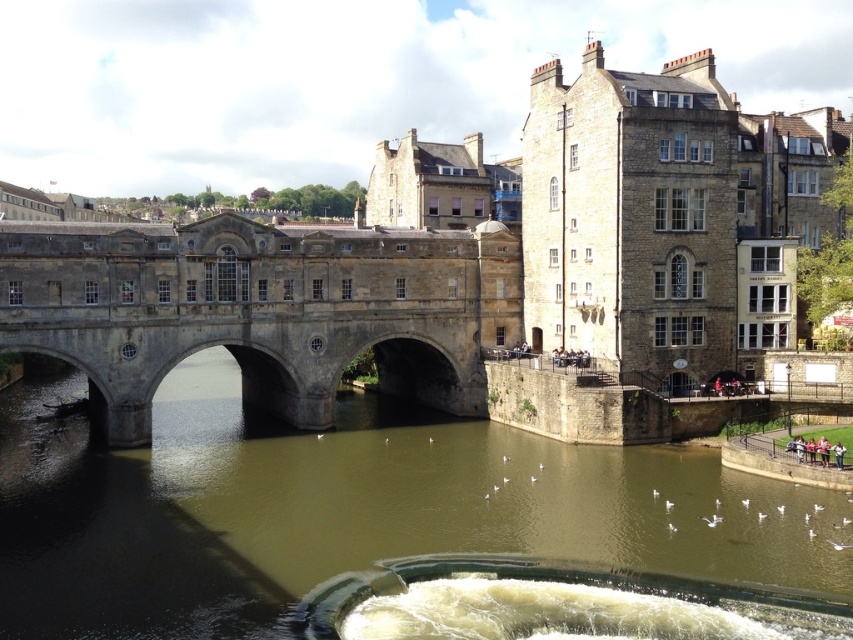
Is point (45, 566) positioned in front of point (390, 317)?

That is True.

Does brown stone river at center lie behind stone bridge at center?

No, brown stone river at center is in front of stone bridge at center.

Is point (173, 484) more distant than point (494, 305)?

No, it is in front of (494, 305).

The height and width of the screenshot is (640, 853). What are the coordinates of `brown stone river at center` in the screenshot? It's located at (349, 509).